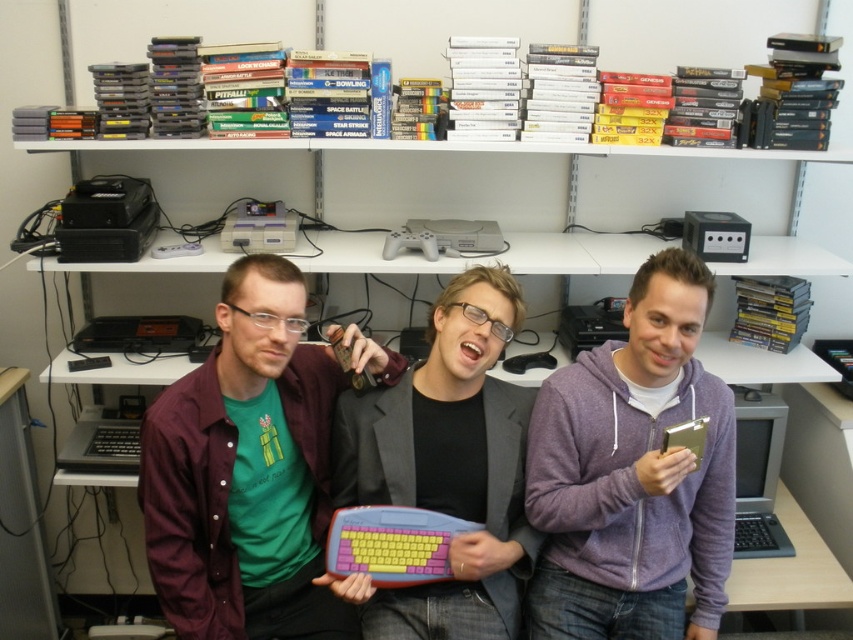
You are standing in front of the shelving unit and want to reach both points. Which point, point (607,476) or point (341,448), is closer to you?

Point (607,476) is closer to the viewer than point (341,448).

You are standing in front of the shelving unit and want to locate the purple fleece hoodie at center. Based on the coordinates provided, where should you look relative to the shelving unit?

The purple fleece hoodie at center is located at coordinates approximately 0.741 on the x axis and 0.743 on the y axis relative to the shelving unit.